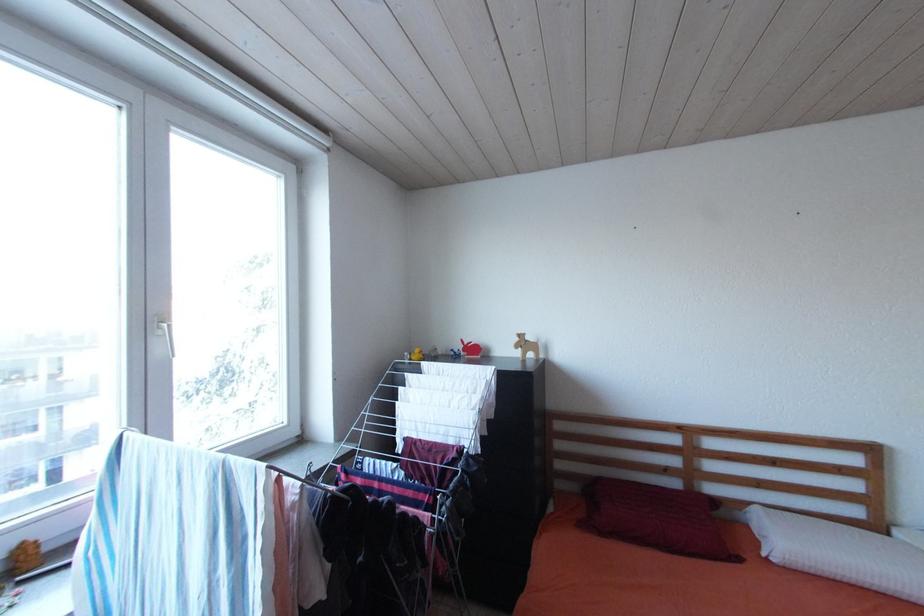
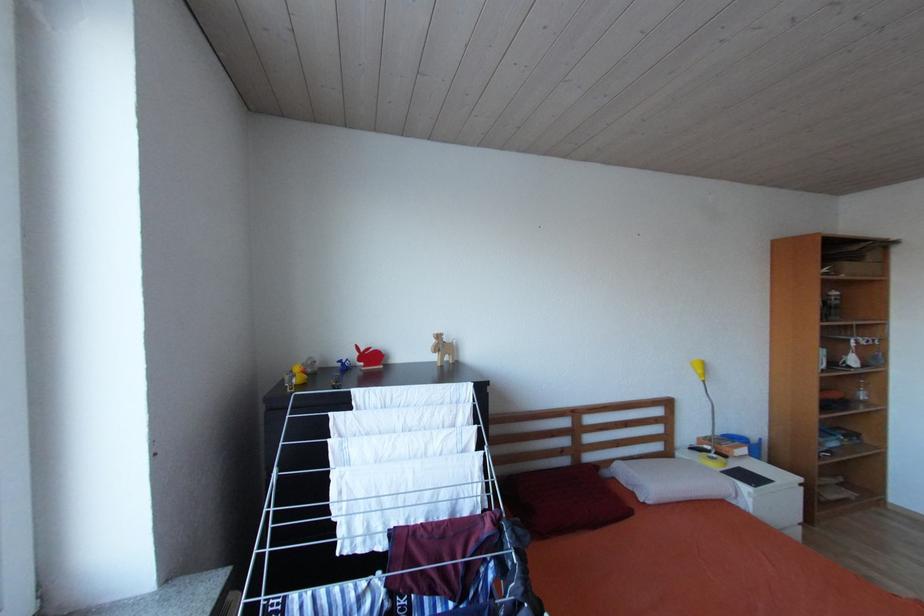
Question: Based on the continuous images, in which direction is the camera rotating? Reply with the corresponding letter.

Choices:
 (A) Left
 (B) Right
 (C) Up
 (D) Down

Answer: (B)